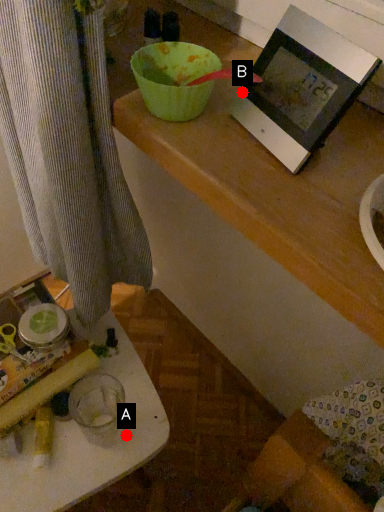
Question: Two points are circled on the image, labeled by A and B beside each circle. Which point appears closest to the camera in this image?

Choices:
 (A) A is closer
 (B) B is closer

Answer: (B)